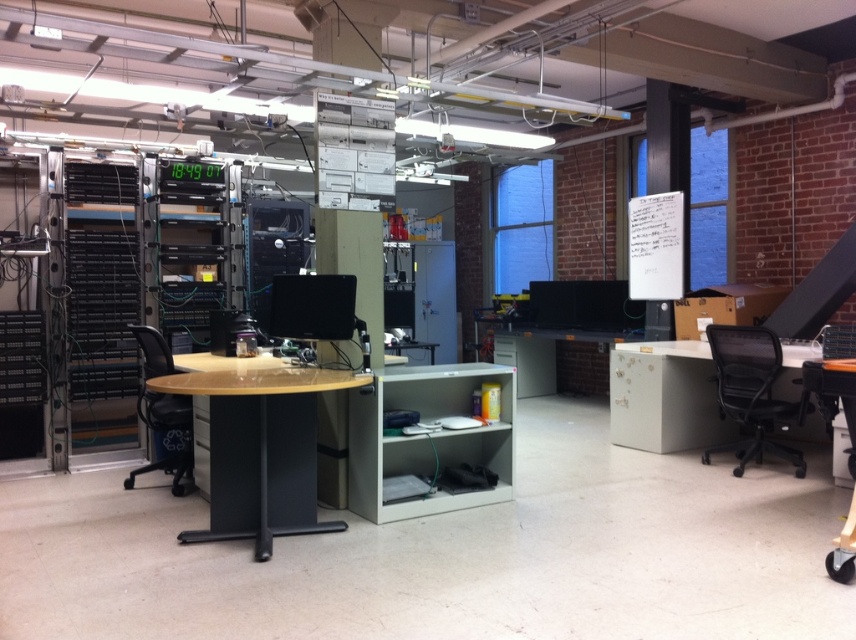
Question: Among these objects, which one is farthest from the camera?

Choices:
 (A) white matte table at right
 (B) light brown glossy table at center

Answer: (A)

Question: Which is nearer to the white matte table at right?

Choices:
 (A) black mesh office chair at right
 (B) black mesh office chair at left
 (C) light brown glossy table at center

Answer: (A)

Question: Among these objects, which one is nearest to the camera?

Choices:
 (A) light brown glossy table at center
 (B) black mesh office chair at left
 (C) white matte table at right
 (D) black mesh office chair at right

Answer: (A)

Question: Does white matte table at right have a larger size compared to black mesh office chair at right?

Choices:
 (A) no
 (B) yes

Answer: (A)

Question: Can you confirm if light brown glossy table at center is positioned above black mesh office chair at right?

Choices:
 (A) yes
 (B) no

Answer: (A)

Question: Is the position of black mesh office chair at right more distant than that of black mesh office chair at left?

Choices:
 (A) no
 (B) yes

Answer: (B)